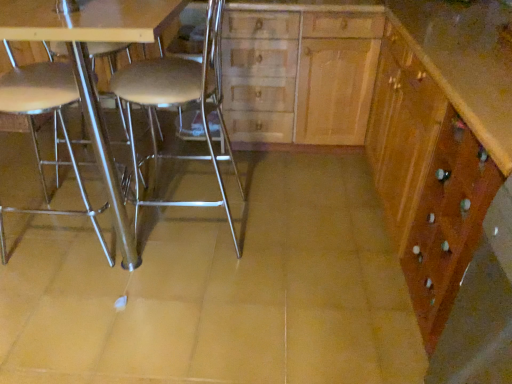
Identify the location of free point behind metallic silver chair at left, arranged as the second chair when viewed from the right. (95, 182).